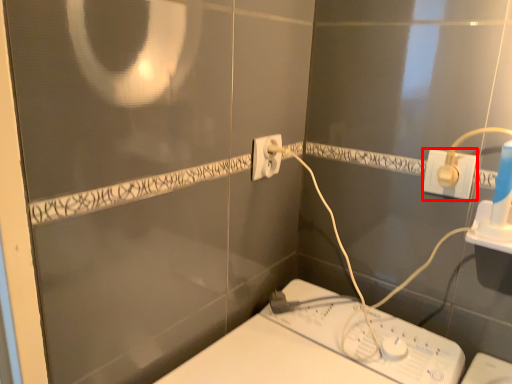
Question: From the image's perspective, considering the relative positions of power plugs and sockets (annotated by the red box) and power plugs and sockets in the image provided, where is power plugs and sockets (annotated by the red box) located with respect to the staircase?

Choices:
 (A) below
 (B) above

Answer: (A)